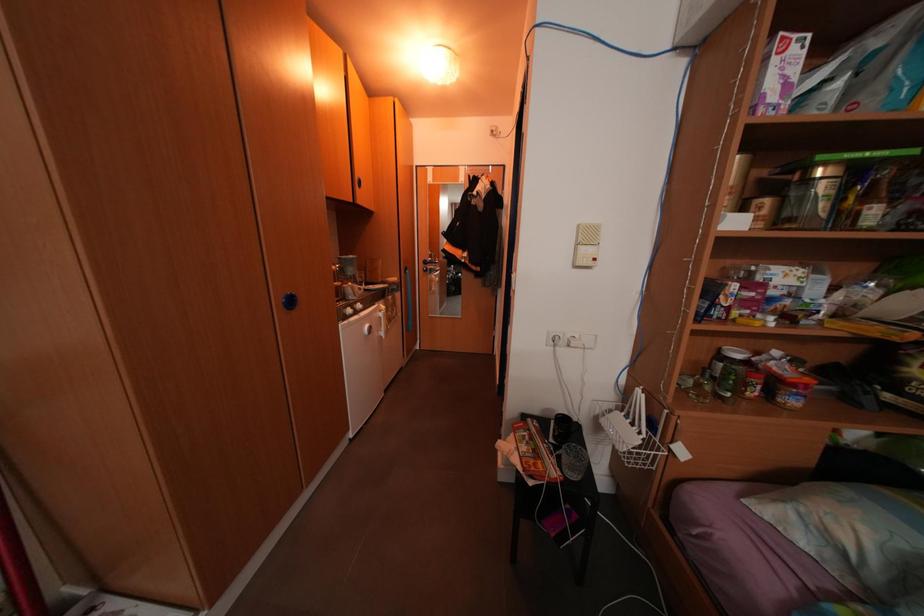
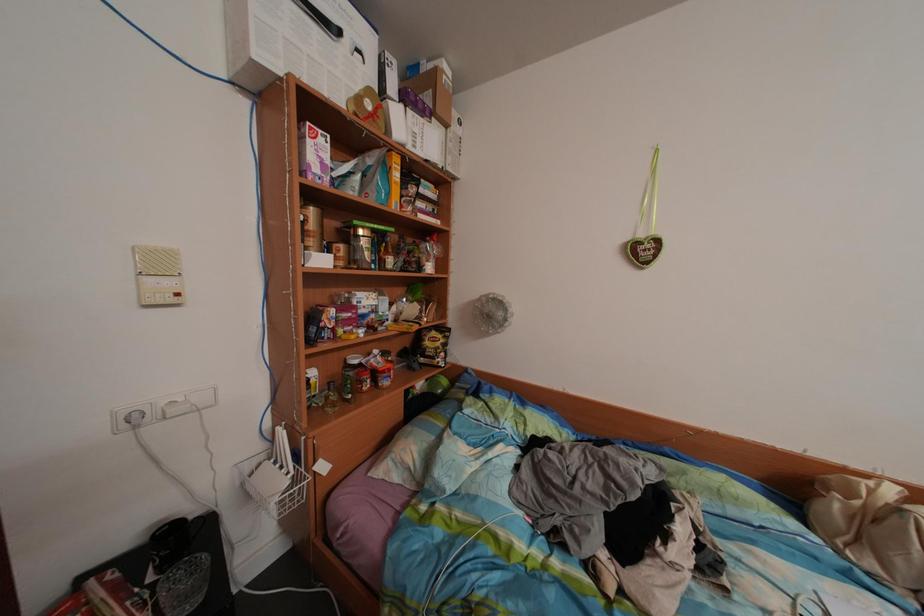
Question: How did the camera likely rotate?

Choices:
 (A) Left
 (B) Right
 (C) Up
 (D) Down

Answer: (B)